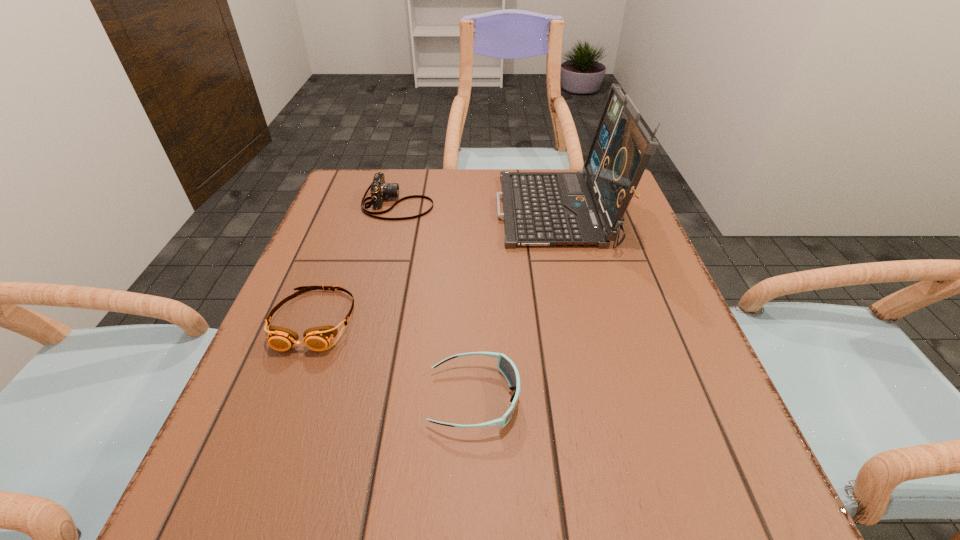
Where is `vacant space that is in between the farther goggles and the nearer goggles`? This screenshot has width=960, height=540. vacant space that is in between the farther goggles and the nearer goggles is located at coordinates (x=395, y=359).

Find the location of a particular element. free area in between the tallest object and the left goggles is located at coordinates (436, 266).

Locate an element on the screen. vacant area that lies between the tallest object and the camera is located at coordinates (478, 208).

The height and width of the screenshot is (540, 960). I want to click on unoccupied position between the laptop computer and the second nearest object, so click(436, 266).

Find the location of `free space between the tallest object and the camera`. free space between the tallest object and the camera is located at coordinates (478, 208).

Locate an element on the screen. This screenshot has width=960, height=540. the second closest object to the right goggles is located at coordinates (539, 208).

Where is `object that stands as the closest to the right goggles`? The height and width of the screenshot is (540, 960). object that stands as the closest to the right goggles is located at coordinates (318, 338).